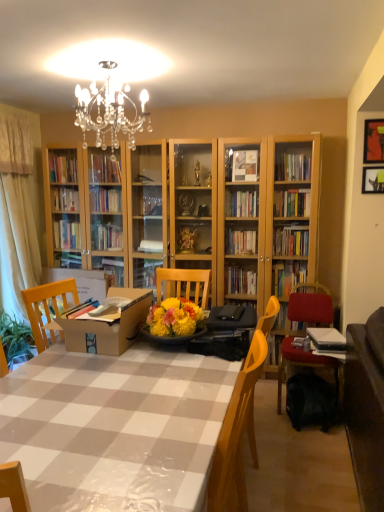
The width and height of the screenshot is (384, 512). In order to click on free point above white glossy table at center (from a real-world perspective) in this screenshot , I will do `click(121, 391)`.